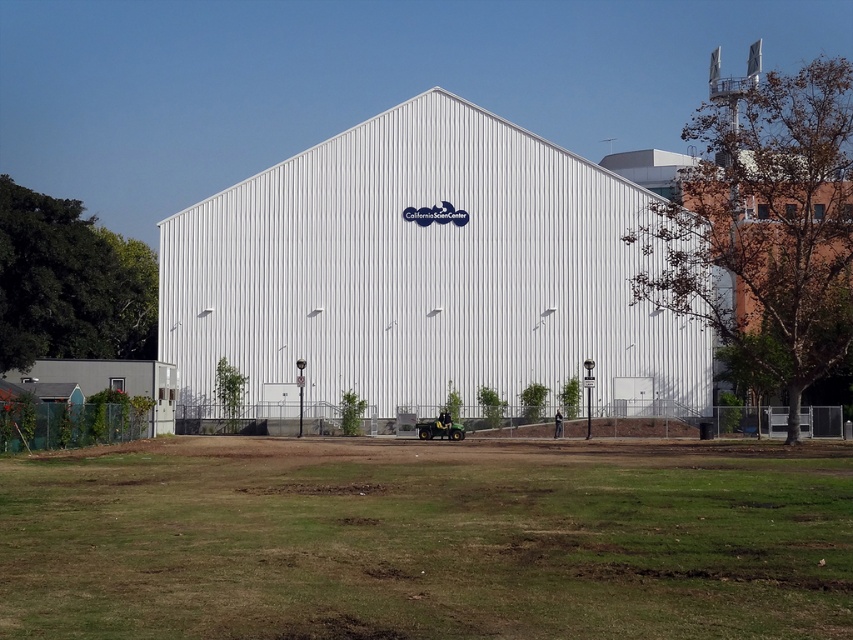
Is green grass at lower center positioned at the back of white corrugated metal building at center?

No, green grass at lower center is closer to the viewer.

From the picture: How far apart are green grass at lower center and white corrugated metal building at center?

green grass at lower center and white corrugated metal building at center are 38.01 meters apart from each other.

Is point (51, 531) positioned in front of point (656, 356)?

Yes, it is.

What are the coordinates of `green grass at lower center` in the screenshot? It's located at (426, 540).